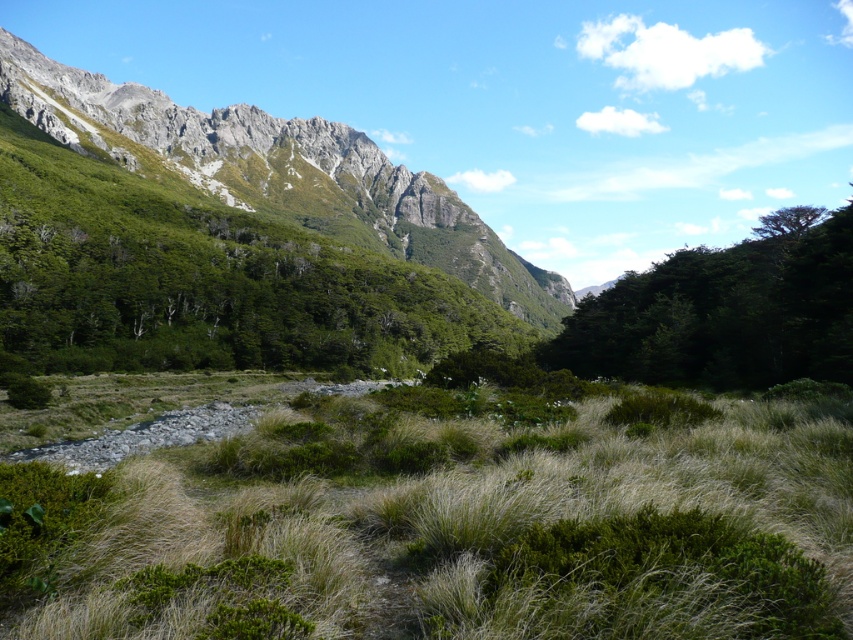
Question: Does green grassy at center have a greater width compared to green leafy tree at upper right?

Choices:
 (A) yes
 (B) no

Answer: (B)

Question: Which point is closer to the camera?

Choices:
 (A) green grassy at center
 (B) gray rocky mountain at upper left

Answer: (A)

Question: Is green grassy at center further to the viewer compared to green leafy tree at upper right?

Choices:
 (A) yes
 (B) no

Answer: (B)

Question: Where is green matte tree at center-right located in relation to green leafy tree at upper right in the image?

Choices:
 (A) below
 (B) above

Answer: (A)

Question: Among these objects, which one is nearest to the camera?

Choices:
 (A) green grassy at center
 (B) green leafy tree at upper right
 (C) gray rocky mountain at upper left

Answer: (A)

Question: Which point is closer to the camera?

Choices:
 (A) green matte tree at center-right
 (B) green grassy at center
 (C) green leafy tree at upper right

Answer: (B)